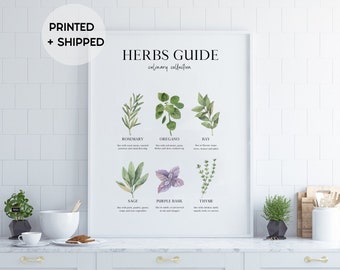
Image resolution: width=340 pixels, height=270 pixels. In order to click on bowl in this screenshot , I will do `click(61, 218)`.